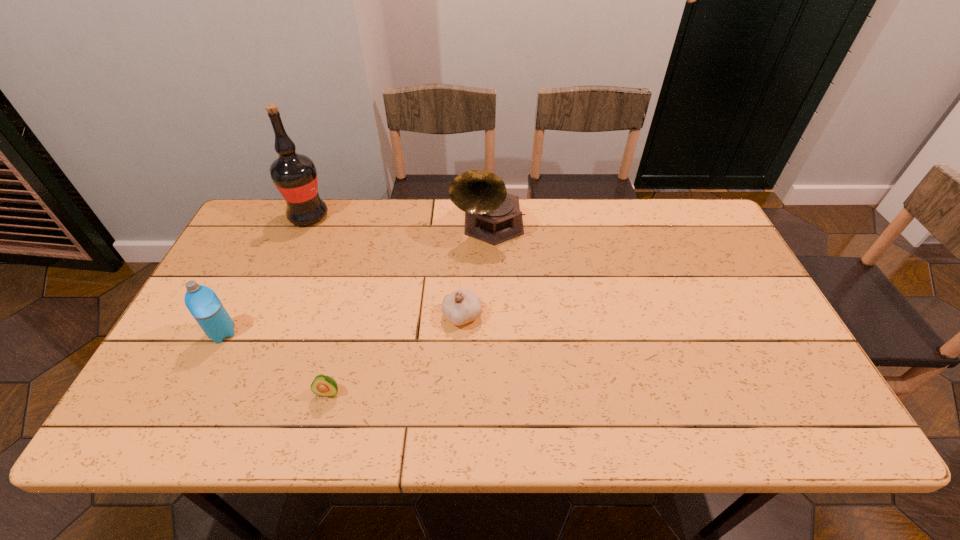
In the image, there is a desktop. At what (x,y) coordinates should I click in order to perform the action: click on free space at the right edge. Please return your answer as a coordinate pair (x, y). Looking at the image, I should click on coord(732,301).

In the image, there is a desktop. Identify the location of vacant space at the far left corner. The height and width of the screenshot is (540, 960). (275, 241).

Identify the location of free region at the near right corner of the desktop. The height and width of the screenshot is (540, 960). (780, 401).

At what (x,y) coordinates should I click in order to perform the action: click on empty space between the shortest object and the garlic. Please return your answer as a coordinate pair (x, y). The image size is (960, 540). Looking at the image, I should click on pos(396,354).

What are the coordinates of `free space between the thermos bottle and the garlic` in the screenshot? It's located at (343, 325).

Locate an element on the screen. vacant space that is in between the third tallest object and the tallest object is located at coordinates (266, 274).

Image resolution: width=960 pixels, height=540 pixels. Find the location of `vacant space that is in between the avocado and the garlic`. vacant space that is in between the avocado and the garlic is located at coordinates (396, 354).

Where is `empty location between the shortest object and the second tallest object`? This screenshot has height=540, width=960. empty location between the shortest object and the second tallest object is located at coordinates (409, 309).

You are a GUI agent. You are given a task and a screenshot of the screen. Output one action in this format:
    pyautogui.click(x=<x>, y=<y>)
    Task: Click on the vacant space in between the garlic and the thermos bottle
    
    Given the screenshot: What is the action you would take?
    pyautogui.click(x=343, y=325)

Where is `blank region between the phonograph record and the thermos bottle`? Image resolution: width=960 pixels, height=540 pixels. blank region between the phonograph record and the thermos bottle is located at coordinates (356, 280).